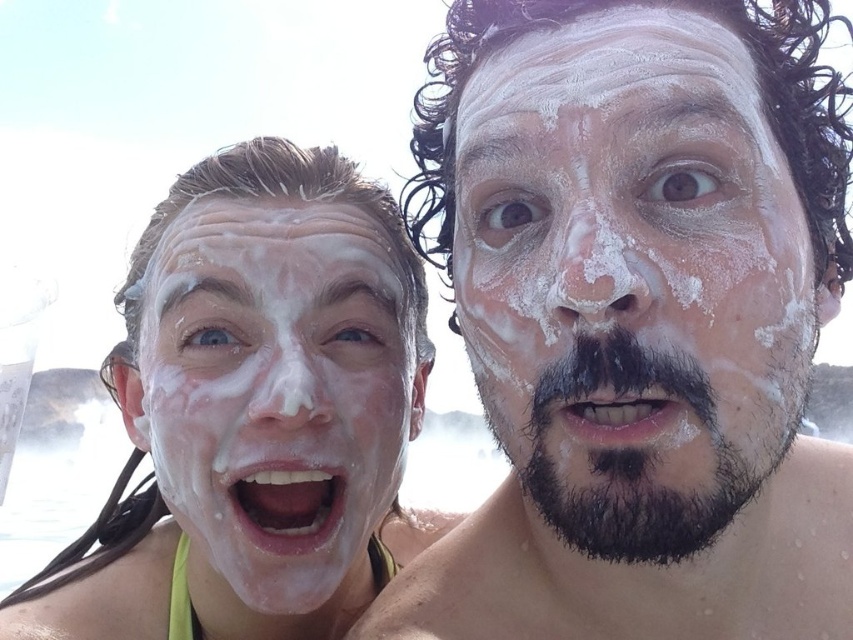
Question: Is white foamy face at center below dark brown thick hair at right?

Choices:
 (A) no
 (B) yes

Answer: (A)

Question: Is white foamy face at center bigger than white foamy face at left?

Choices:
 (A) yes
 (B) no

Answer: (B)

Question: Among these points, which one is nearest to the camera?

Choices:
 (A) (659, 163)
 (B) (572, 374)
 (C) (390, 570)
 (D) (148, 428)

Answer: (A)

Question: Among these objects, which one is farthest from the camera?

Choices:
 (A) white foamy face at center
 (B) white foamy face at left

Answer: (B)

Question: Is white foamy face at center wider than white matte foam at left?

Choices:
 (A) no
 (B) yes

Answer: (A)

Question: Among these points, which one is nearest to the camera?

Choices:
 (A) (178, 424)
 (B) (621, 147)
 (C) (607, 528)
 (D) (299, 202)

Answer: (B)